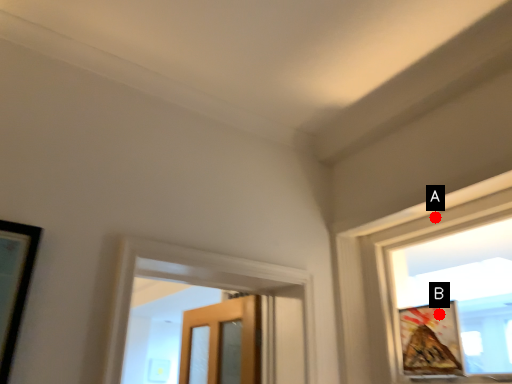
Question: Two points are circled on the image, labeled by A and B beside each circle. Which point appears farthest from the camera in this image?

Choices:
 (A) A is further
 (B) B is further

Answer: (A)